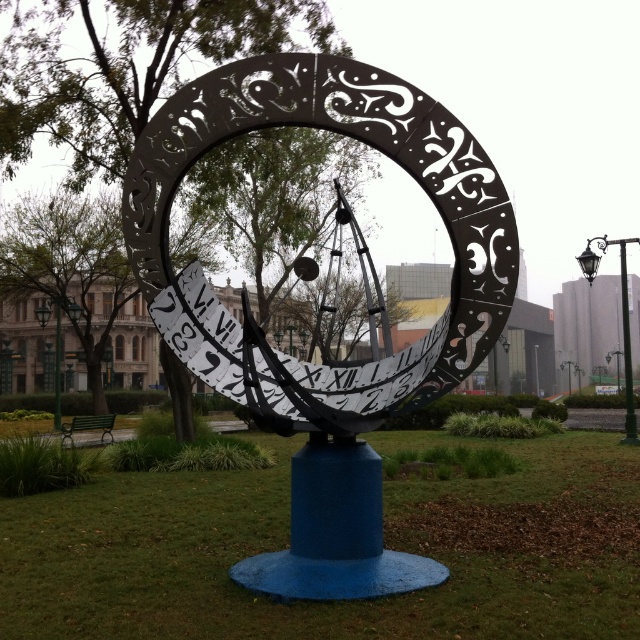
Question: Does metallic blue sundial at center appear under white metallic clock face at center?

Choices:
 (A) no
 (B) yes

Answer: (B)

Question: Is black metal clock at center wider than black metal pole at right?

Choices:
 (A) no
 (B) yes

Answer: (A)

Question: Estimate the real-world distances between objects in this image. Which object is farther from the white metallic clock face at center?

Choices:
 (A) black metal clock at center
 (B) metallic blue sundial at center

Answer: (B)

Question: Does metallic blue sundial at center have a smaller size compared to black metal pole at right?

Choices:
 (A) no
 (B) yes

Answer: (B)

Question: Which point is farther from the camera taking this photo?

Choices:
 (A) (140, 268)
 (B) (212, 355)
 (C) (614, 440)

Answer: (C)

Question: Based on their relative distances, which object is farther from the black metal clock at center?

Choices:
 (A) white metallic clock face at center
 (B) metallic blue sundial at center

Answer: (B)